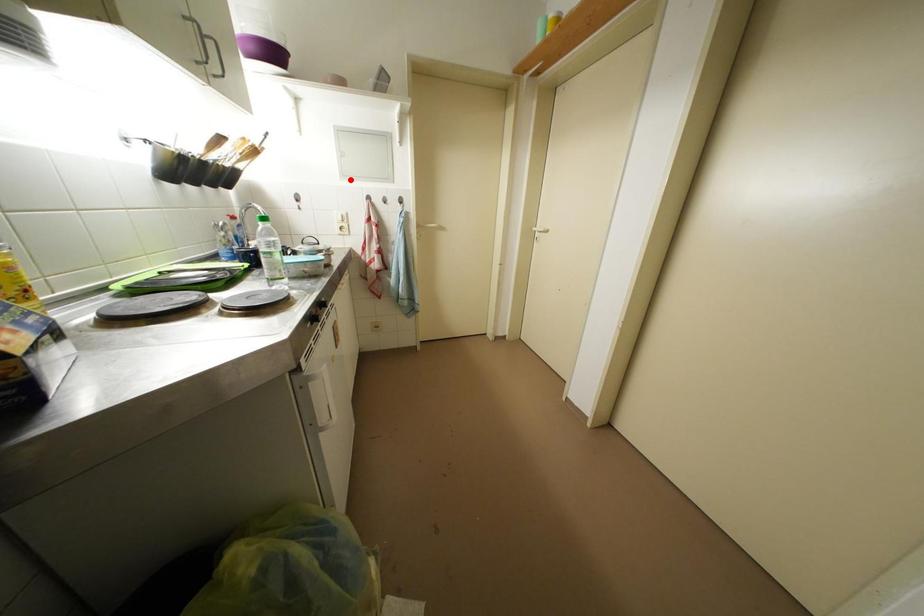
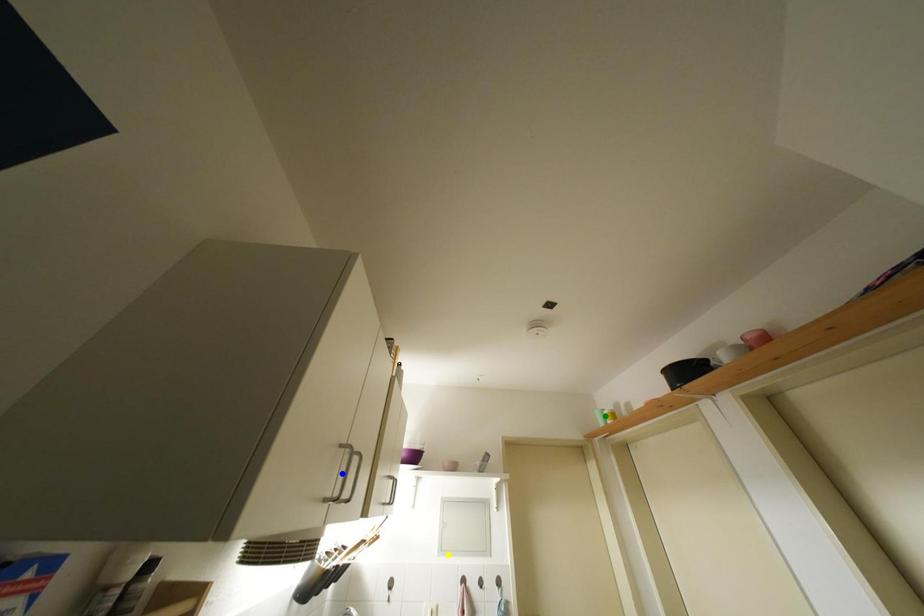
Question: I am providing you with two images of the same scene from different viewpoints. A red point is marked on the first image. You are given multiple points on the second image. In image 2, which mark is for the same physical point as the one in image 1?

Choices:
 (A) yellow point
 (B) blue point
 (C) green point

Answer: (A)